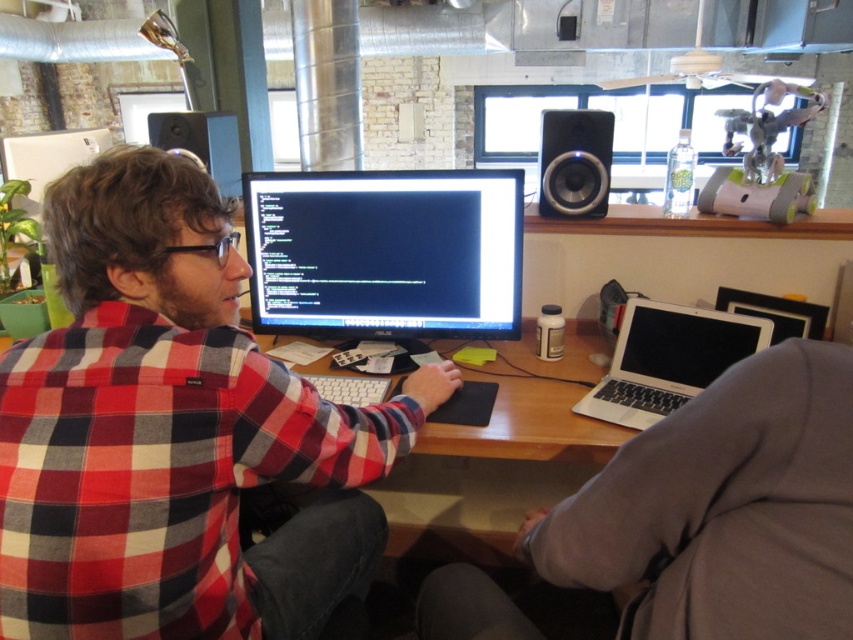
Does red plaid shirt at center appear under black matte speaker at upper right?

Indeed, red plaid shirt at center is positioned under black matte speaker at upper right.

Who is more distant from viewer, (276, 563) or (541, 144)?

The point (541, 144) is more distant.

The height and width of the screenshot is (640, 853). Identify the location of red plaid shirt at center. (173, 433).

Is red plaid shirt at center taller than black glossy monitor at center?

Yes, red plaid shirt at center is taller than black glossy monitor at center.

Between red plaid shirt at center and black glossy monitor at center, which one has less height?

black glossy monitor at center is shorter.

Identify the location of red plaid shirt at center. Image resolution: width=853 pixels, height=640 pixels. [x=173, y=433].

From the picture: Does gray fabric jacket at lower right appear under matte black speaker at upper left?

Yes.

Does gray fabric jacket at lower right come behind matte black speaker at upper left?

No, gray fabric jacket at lower right is closer to the viewer.

Measure the distance between point [743,572] and camera.

The distance of point [743,572] from camera is 70.69 centimeters.

The height and width of the screenshot is (640, 853). I want to click on gray fabric jacket at lower right, so click(723, 508).